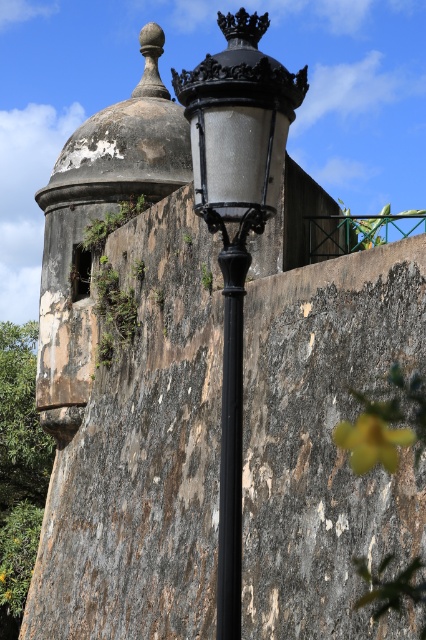
You are standing at the base of the historic stone wall and see two points marked on the wall. The first point is at coordinates point [224,394] and the second is at point [356,426]. Which point is closer to you?

Point [224,394] is in front of point [356,426], so the first point is closer to you.